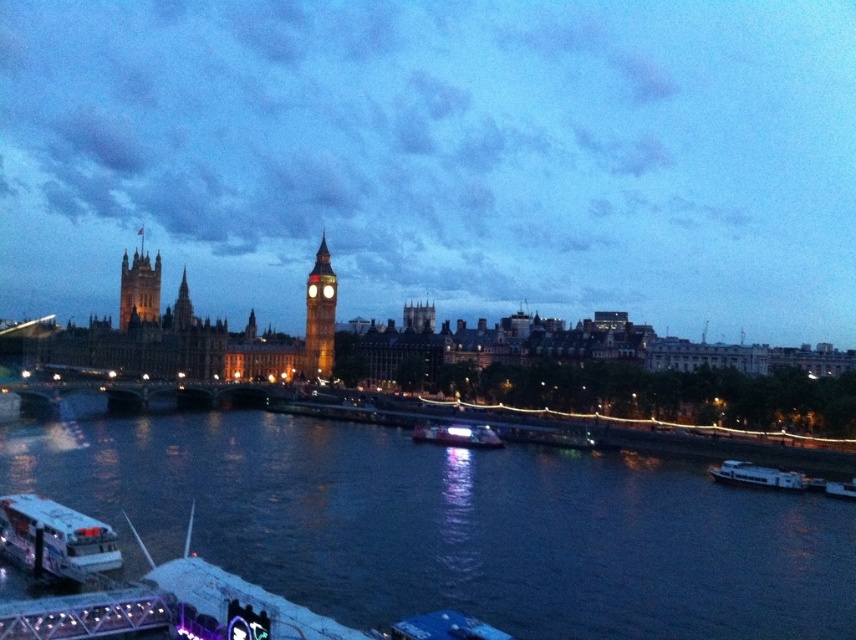
Question: Which object is positioned farthest from the white plastic boat at lower left?

Choices:
 (A) dark blue water at lower center
 (B) metallic silver boat at center

Answer: (B)

Question: Where is dark blue water at lower center located in relation to metallic silver boat at center in the image?

Choices:
 (A) below
 (B) above

Answer: (A)

Question: Which point is farther to the camera?

Choices:
 (A) dark blue water at lower center
 (B) brick clock tower at center

Answer: (B)

Question: Which point appears farthest from the camera in this image?

Choices:
 (A) (730, 625)
 (B) (465, 436)
 (C) (771, 476)

Answer: (B)

Question: Is golden stone tower at left in front of white glossy boat at lower right?

Choices:
 (A) yes
 (B) no

Answer: (B)

Question: Is white plastic boat at lower left to the right of golden stone tower at left from the viewer's perspective?

Choices:
 (A) yes
 (B) no

Answer: (A)